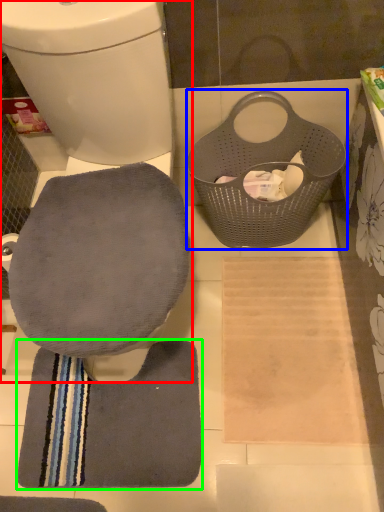
Question: Estimate the real-world distances between objects in this image. Which object is closer to toilet (highlighted by a red box), laundry basket (highlighted by a blue box) or bath towel (highlighted by a green box)?

Choices:
 (A) laundry basket
 (B) bath towel

Answer: (A)